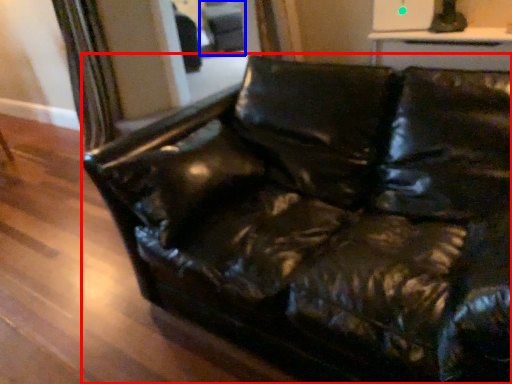
Question: Which object is further to the camera taking this photo, studio couch (highlighted by a red box) or swivel chair (highlighted by a blue box)?

Choices:
 (A) studio couch
 (B) swivel chair

Answer: (B)